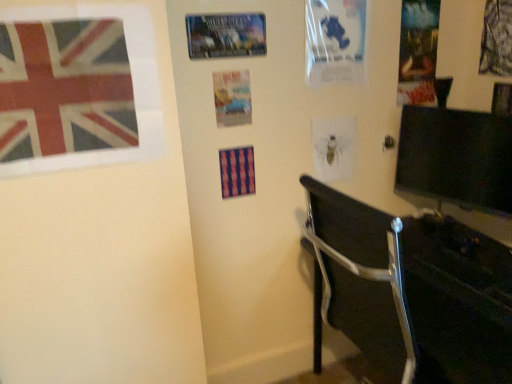
Question: From a real-world perspective, is metallic silver poster at upper center, which appears as the sixth poster page when viewed from the right, above or below printed fabric flag at upper left?

Choices:
 (A) above
 (B) below

Answer: (A)

Question: Is metallic silver poster at upper center, marked as the first poster page in a left-to-right arrangement, in front of or behind printed fabric flag at upper left in the image?

Choices:
 (A) behind
 (B) front

Answer: (A)

Question: Which object is the closest to the matte plastic poster at center, placed as the 5th poster page when sorted from right to left?

Choices:
 (A) translucent paper poster at center, which is the 4th poster page in left-to-right order
 (B) textured fabric poster at upper right, arranged as the sixth poster page when viewed from the left
 (C) pink fabric poster at center
 (D) matte paper poster at upper right, marked as the second poster page in a right-to-left arrangement
 (E) transparent plastic poster at upper center, placed as the 4th poster page when sorted from right to left

Answer: (C)

Question: Which object is positioned closest to the printed fabric flag at upper left?

Choices:
 (A) pink fabric poster at center
 (B) transparent plastic poster at upper center, placed as the 4th poster page when sorted from right to left
 (C) metallic silver poster at upper center, which appears as the sixth poster page when viewed from the right
 (D) translucent paper poster at center, which is the 4th poster page in left-to-right order
 (E) matte plastic poster at center, placed as the 5th poster page when sorted from right to left

Answer: (C)